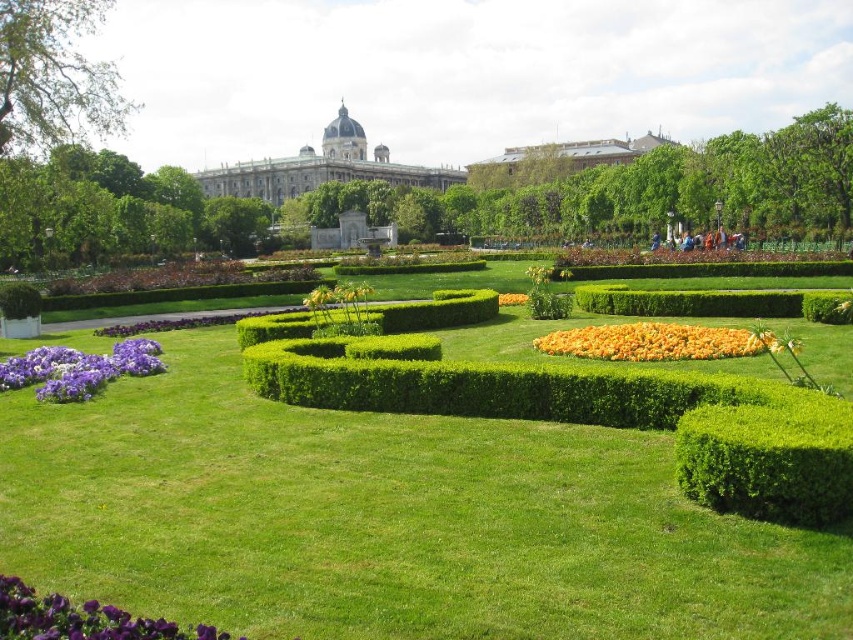
Between gray stone palace at upper center and purple matte flowers at lower left, which one is positioned higher?

gray stone palace at upper center is higher up.

Image resolution: width=853 pixels, height=640 pixels. Describe the element at coordinates (321, 168) in the screenshot. I see `gray stone palace at upper center` at that location.

At what (x,y) coordinates should I click in order to perform the action: click on gray stone palace at upper center. Please return your answer as a coordinate pair (x, y). This screenshot has width=853, height=640. Looking at the image, I should click on (321, 168).

Measure the distance between yellow/yellowish-green/yellow-green/yellowish/green/yellow-green/yellow/green/yellow-green/yellow/green/yellow-green/yellow/green/yellow-green/yellow/green/yellow-green/yellow/green/yellow-green/yellow/green/yellow-green/yellow/green/yellow-green/yellow/green/yellow-green/yellow/green/yellow-green/yellow/green/yellow-green/yellow/green/yellow-green/yellow/green/yellow-green/yellow/green/yellow-green/yellow/green/yellow-green/yellow/green/yellow-green/yellow/green/yellow-green and purple matte flower at lower left.

A distance of 25.49 meters exists between yellow/yellowish-green/yellow-green/yellowish/green/yellow-green/yellow/green/yellow-green/yellow/green/yellow-green/yellow/green/yellow-green/yellow/green/yellow-green/yellow/green/yellow-green/yellow/green/yellow-green/yellow/green/yellow-green/yellow/green/yellow-green/yellow/green/yellow-green/yellow/green/yellow-green/yellow/green/yellow-green/yellow/green/yellow-green/yellow/green/yellow-green/yellow/green/yellow-green/yellow/green/yellow-green/yellow/green/yellow-green and purple matte flower at lower left.

Is yellow/yellowish-green/yellow-green/yellowish/green/yellow-green/yellow/green/yellow-green/yellow/green/yellow-green/yellow/green/yellow-green/yellow/green/yellow-green/yellow/green/yellow-green/yellow/green/yellow-green/yellow/green/yellow-green/yellow/green/yellow-green/yellow/green/yellow-green/yellow/green/yellow-green/yellow/green/yellow-green/yellow/green/yellow-green/yellow/green/yellow-green/yellow/green/yellow-green/yellow/green/yellow-green/yellow/green/yellow-green smaller than purple matte flower at lower left?

No, yellow/yellowish-green/yellow-green/yellowish/green/yellow-green/yellow/green/yellow-green/yellow/green/yellow-green/yellow/green/yellow-green/yellow/green/yellow-green/yellow/green/yellow-green/yellow/green/yellow-green/yellow/green/yellow-green/yellow/green/yellow-green/yellow/green/yellow-green/yellow/green/yellow-green/yellow/green/yellow-green/yellow/green/yellow-green/yellow/green/yellow-green/yellow/green/yellow-green/yellow/green/yellow-green/yellow/green/yellow-green is not smaller than purple matte flower at lower left.

This screenshot has width=853, height=640. What do you see at coordinates (657, 340) in the screenshot?
I see `yellow/yellowish-green/yellow-green/yellowish/green/yellow-green/yellow/green/yellow-green/yellow/green/yellow-green/yellow/green/yellow-green/yellow/green/yellow-green/yellow/green/yellow-green/yellow/green/yellow-green/yellow/green/yellow-green/yellow/green/yellow-green/yellow/green/yellow-green/yellow/green/yellow-green/yellow/green/yellow-green/yellow/green/yellow-green/yellow/green/yellow-green/yellow/green/yellow-green/yellow/green/yellow-green/yellow/green/yellow-green` at bounding box center [657, 340].

This screenshot has width=853, height=640. Identify the location of yellow/yellowish-green/yellow-green/yellowish/green/yellow-green/yellow/green/yellow-green/yellow/green/yellow-green/yellow/green/yellow-green/yellow/green/yellow-green/yellow/green/yellow-green/yellow/green/yellow-green/yellow/green/yellow-green/yellow/green/yellow-green/yellow/green/yellow-green/yellow/green/yellow-green/yellow/green/yellow-green/yellow/green/yellow-green/yellow/green/yellow-green/yellow/green/yellow-green/yellow/green/yellow-green/yellow/green/yellow-green. (657, 340).

Is green leafy hedge at lower right wider than green leafy hedge at center?

No, green leafy hedge at lower right is not wider than green leafy hedge at center.

Which is in front, point (728, 461) or point (654, 291)?

Point (728, 461)

The height and width of the screenshot is (640, 853). In order to click on green leafy hedge at lower right in this screenshot , I will do `click(769, 458)`.

Identify the location of green leafy hedge at lower right. (769, 458).